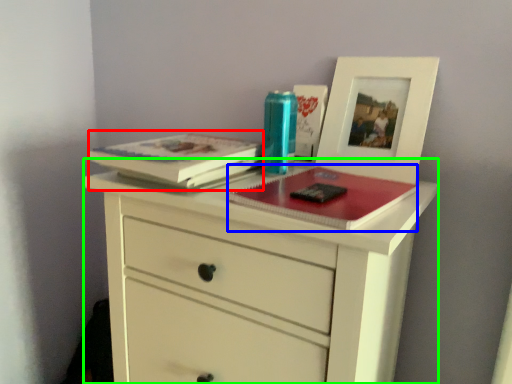
Question: Estimate the real-world distances between objects in this image. Which object is farther from paperback book (highlighted by a red box), magazine (highlighted by a blue box) or chest of drawers (highlighted by a green box)?

Choices:
 (A) magazine
 (B) chest of drawers

Answer: (B)